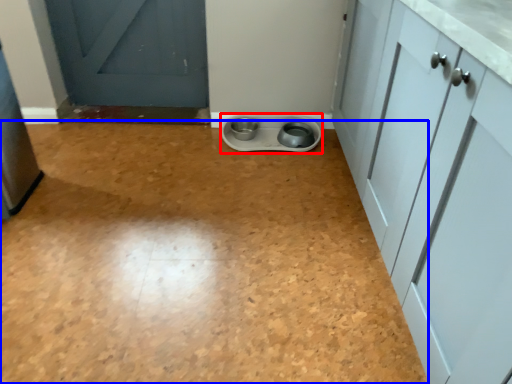
Question: Which object is further to the camera taking this photo, appliance (highlighted by a red box) or plain (highlighted by a blue box)?

Choices:
 (A) appliance
 (B) plain

Answer: (A)